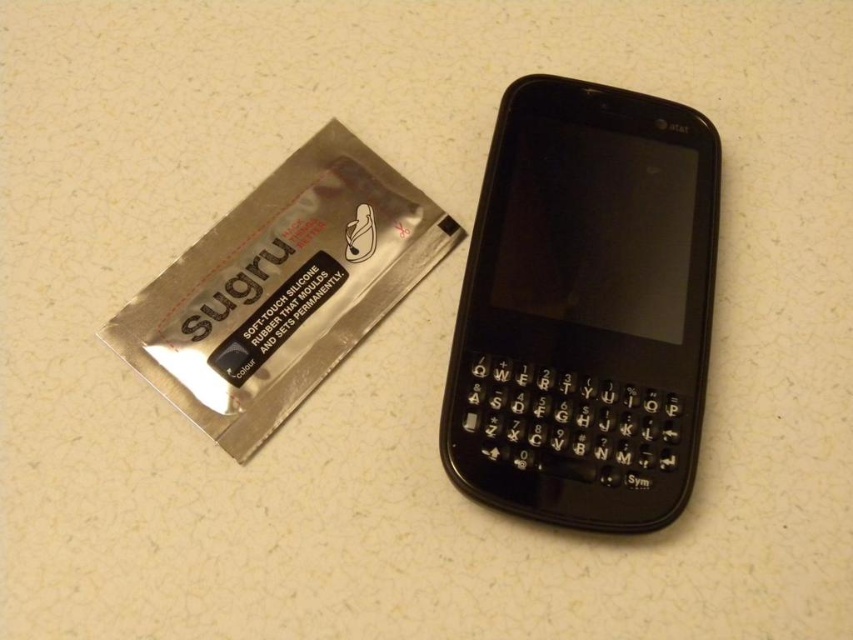
Question: Among these objects, which one is nearest to the camera?

Choices:
 (A) silver/silicone sugru at left
 (B) black plastic smartphone at center

Answer: (B)

Question: In this image, where is black plastic smartphone at center located relative to silver/silicone sugru at left?

Choices:
 (A) below
 (B) above

Answer: (A)

Question: Does black plastic smartphone at center have a lesser width compared to silver/silicone sugru at left?

Choices:
 (A) yes
 (B) no

Answer: (A)

Question: Does black plastic smartphone at center have a smaller size compared to silver/silicone sugru at left?

Choices:
 (A) no
 (B) yes

Answer: (A)

Question: Which point is farther to the camera?

Choices:
 (A) (590, 129)
 (B) (329, 253)

Answer: (B)